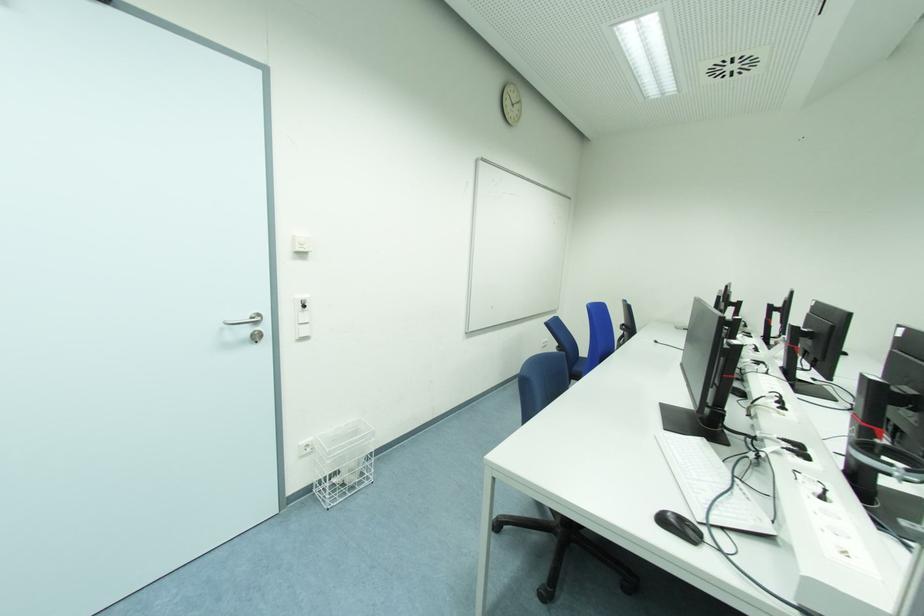
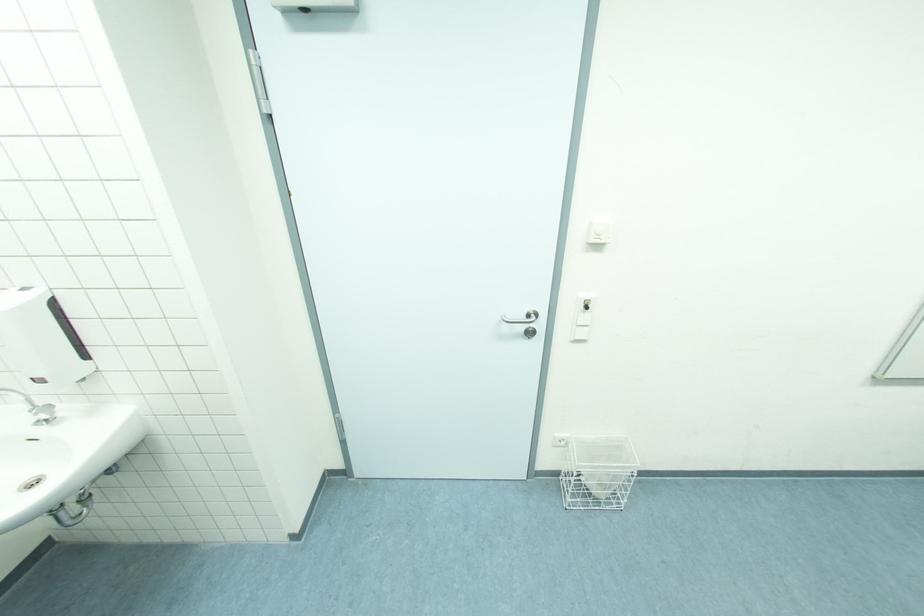
Locate, in the second image, the point that corresponds to point 307,318 in the first image.

(589, 318)